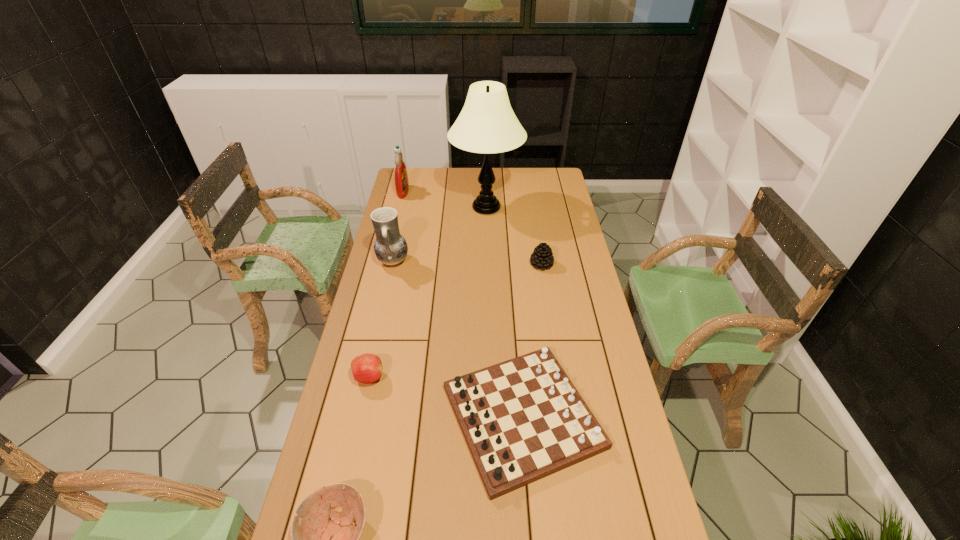
Where is `vacant space located 0.290m on the front of the apple`? vacant space located 0.290m on the front of the apple is located at coordinates (345, 485).

Locate an element on the screen. free point located on the back of the chessboard is located at coordinates (514, 301).

At what (x,y) coordinates should I click in order to perform the action: click on lamp present at the far edge. Please return your answer as a coordinate pair (x, y). The image size is (960, 540). Looking at the image, I should click on (487, 124).

This screenshot has width=960, height=540. Find the location of `detergent at the far edge`. detergent at the far edge is located at coordinates (401, 177).

Find the location of a particular element. detergent that is at the left edge is located at coordinates (401, 177).

Find the location of a particular element. This screenshot has width=960, height=540. pottery that is at the left edge is located at coordinates (390, 247).

Identify the location of apple located at the left edge. (367, 368).

I want to click on pinecone located in the right edge section of the desktop, so click(542, 257).

This screenshot has height=540, width=960. What are the coordinates of `chessboard at the right edge` in the screenshot? It's located at (523, 419).

This screenshot has height=540, width=960. I want to click on object present at the far left corner, so click(x=401, y=177).